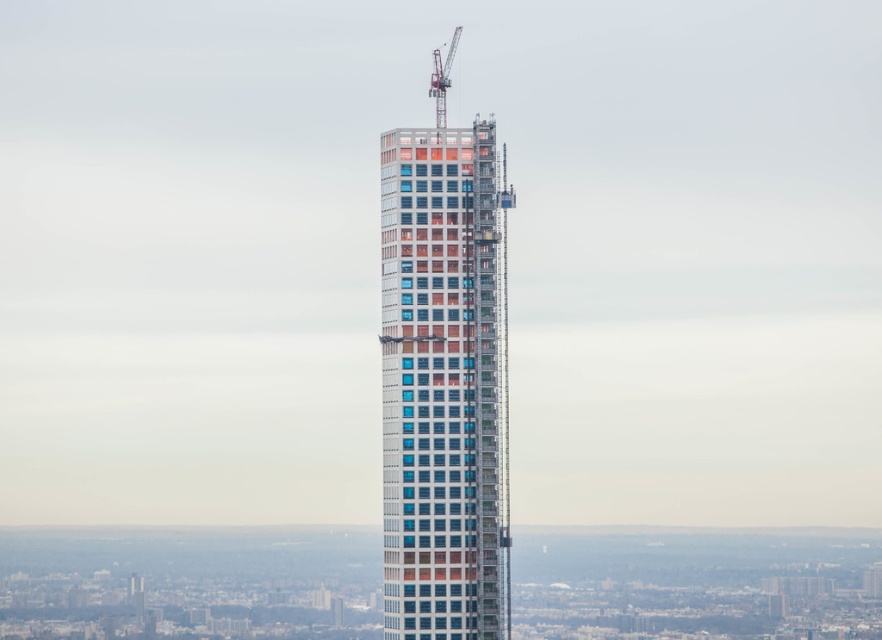
Measure the distance between brick-like textured building at center and camera.

brick-like textured building at center and camera are 2122.28 feet apart.

Who is more forward, (395, 317) or (447, 52)?

Point (395, 317) is more forward.

Which is in front, point (415, 352) or point (439, 70)?

Point (415, 352)

Where is `brick-like textured building at center`? Image resolution: width=882 pixels, height=640 pixels. brick-like textured building at center is located at coordinates (446, 381).